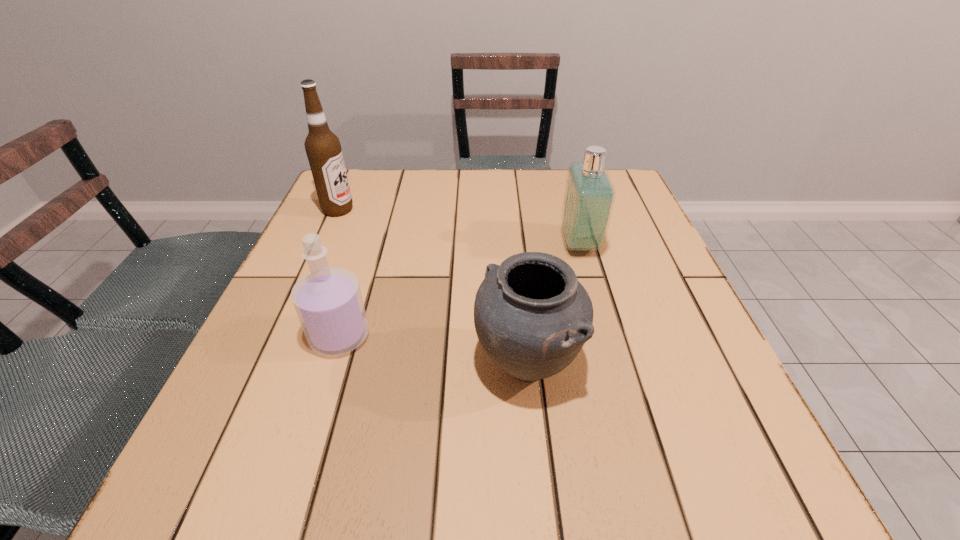
The width and height of the screenshot is (960, 540). I want to click on the tallest object, so tap(323, 148).

Image resolution: width=960 pixels, height=540 pixels. I want to click on alcohol, so click(323, 148).

The image size is (960, 540). I want to click on the farther perfume, so coord(589,196).

Locate an element on the screen. the third nearest object is located at coordinates (589, 196).

This screenshot has height=540, width=960. I want to click on the left perfume, so click(328, 301).

This screenshot has height=540, width=960. Identify the location of the nearer perfume. (328, 301).

At what (x,y) coordinates should I click in order to perform the action: click on urn. Please return your answer as a coordinate pair (x, y). The width and height of the screenshot is (960, 540). Looking at the image, I should click on click(x=532, y=316).

This screenshot has width=960, height=540. Find the location of `vacant area located 0.280m on the label of the leftmost object`. vacant area located 0.280m on the label of the leftmost object is located at coordinates (463, 210).

In order to click on vacant area located on the front label of the farther perfume in this screenshot , I will do `click(463, 244)`.

You are a GUI agent. You are given a task and a screenshot of the screen. Output one action in this format:
    pyautogui.click(x=<x>, y=<y>)
    Task: Click on the free space located on the front label of the farther perfume
    
    Given the screenshot: What is the action you would take?
    pyautogui.click(x=390, y=244)